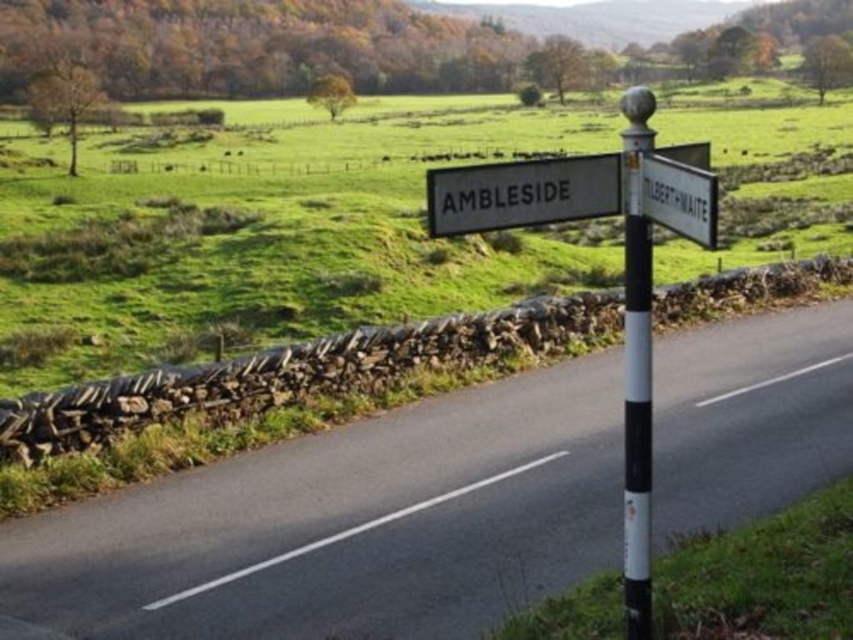
The image size is (853, 640). In order to click on black and white striped pole at center-right in this screenshot , I will do `click(636, 365)`.

Is black and white striped pole at center-right thinner than white plastic sign at center?

Incorrect, black and white striped pole at center-right's width is not less than white plastic sign at center's.

Measure the distance between point (648,474) and camera.

They are 4.80 meters apart.

What are the coordinates of `black and white striped pole at center-right` in the screenshot? It's located at (636, 365).

Does white plastic street sign at center appear over white plastic sign at center?

Incorrect, white plastic street sign at center is not positioned above white plastic sign at center.

Which is below, white plastic street sign at center or white plastic sign at center?

white plastic street sign at center is lower down.

Is point (549, 204) more distant than point (544, 163)?

Yes, it is behind point (544, 163).

The width and height of the screenshot is (853, 640). I want to click on white plastic street sign at center, so click(624, 268).

Does white plastic street sign at center have a larger size compared to black and white striped pole at center-right?

Yes.

Based on the photo, is white plastic street sign at center above black and white striped pole at center-right?

Indeed, white plastic street sign at center is positioned over black and white striped pole at center-right.

What do you see at coordinates (624, 268) in the screenshot? The height and width of the screenshot is (640, 853). I see `white plastic street sign at center` at bounding box center [624, 268].

Locate an element on the screen. white plastic street sign at center is located at coordinates (624, 268).